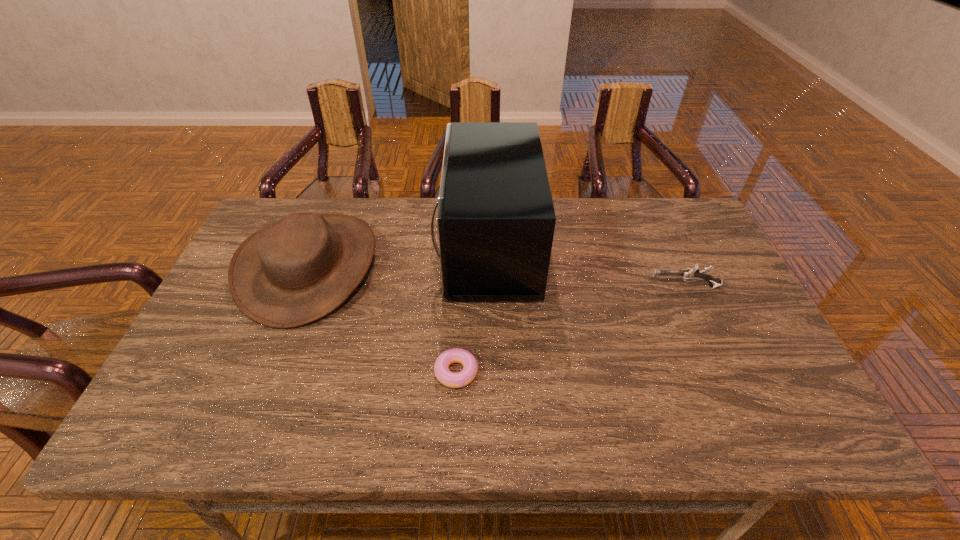
Locate an element on the screen. free space between the tallest object and the third tallest object is located at coordinates (586, 267).

Where is `free space between the third shortest object and the tallest object`? The image size is (960, 540). free space between the third shortest object and the tallest object is located at coordinates (398, 256).

Identify the location of free space between the tallest object and the second tallest object. (398, 256).

This screenshot has height=540, width=960. Find the location of `object that ranks as the second closest to the third shortest object`. object that ranks as the second closest to the third shortest object is located at coordinates (455, 355).

Select which object appears as the second closest to the microwave oven. Please provide its 2D coordinates. Your answer should be formatted as a tuple, i.e. [(x, y)], where the tuple contains the x and y coordinates of a point satisfying the conditions above.

[(300, 268)]

The height and width of the screenshot is (540, 960). I want to click on vacant space that satisfies the following two spatial constraints: 1. with the door open on the microwave oven; 2. on the front side of the cowboy hat, so click(488, 266).

Find the location of a particular element. vacant space that satisfies the following two spatial constraints: 1. on the front side of the nearest object; 2. on the right side of the third shortest object is located at coordinates (267, 372).